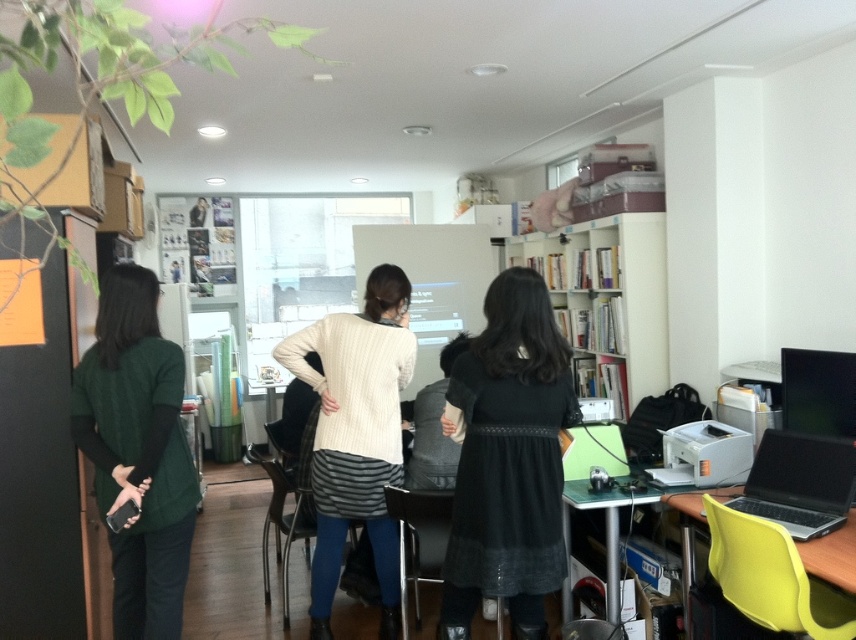
Based on the coordinates provided, which object is located at point (355, 435) in the scene?

The point (355, 435) corresponds to the white knitted sweater at center.

Based on the photo, you are a delivery robot with a package that requires a surface to place it. The package is 1.5 meters wide. You need to place it on either the white glossy bookshelf at upper center or the metallic silver table at lower right. Which surface can accommodate the package?

The metallic silver table at lower right can accommodate the package since the distance between the white glossy bookshelf at upper center and the metallic silver table at lower right is 1.46 meters, which is less than the package width. However, the table itself might be the correct surface, but the description only mentions the distance between them, not the table dimensions. Wait, the question is about the surface width. Hmm, the objects description only provides the distance between the two objects, not

You are organizing a photoshoot and need to ensure proper spacing between models. You have two models dressed in the black matte dress at center and green knitted sweater at left. The minimum required distance between them for the shot is 1.2 meters. Based on the scene, will they need to adjust their positions?

The black matte dress at center is 1.13 meters from the green knitted sweater at left. Since the required distance is 1.2 meters, they are currently 0.07 meters too close and need to move further apart.